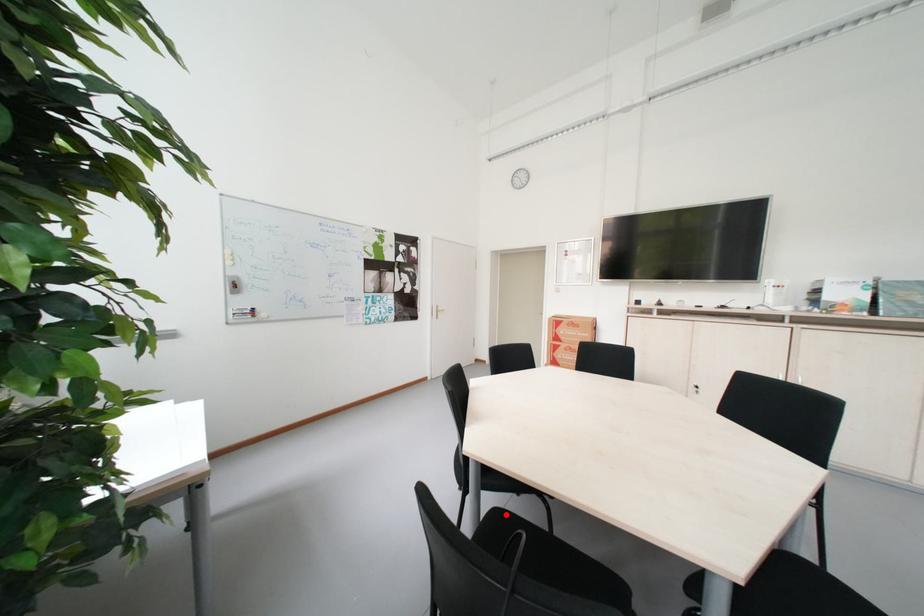
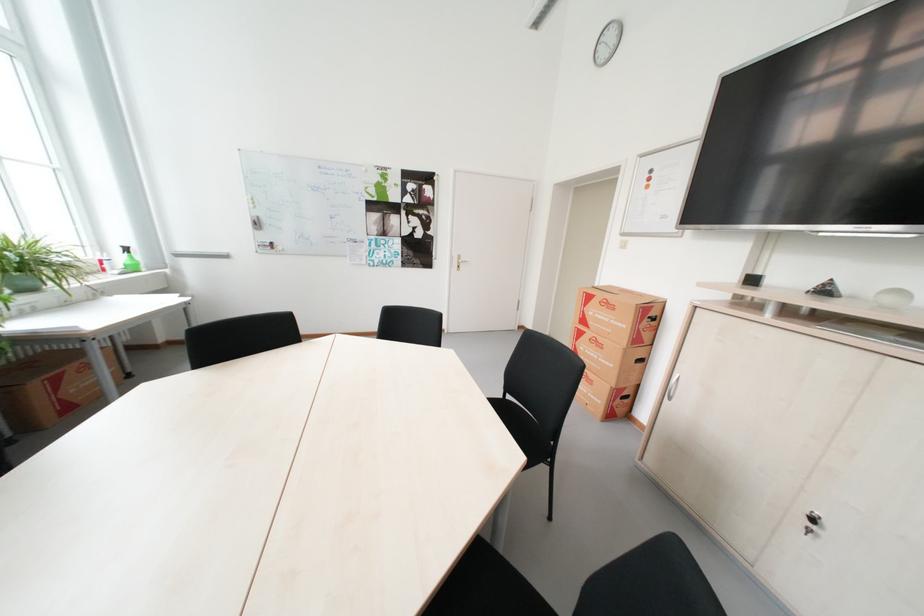
Question: I am providing you with two images of the same scene from different viewpoints. A red point is marked on the first image. Can you still see the location of the red point in image 2?

Choices:
 (A) Yes
 (B) No

Answer: (B)